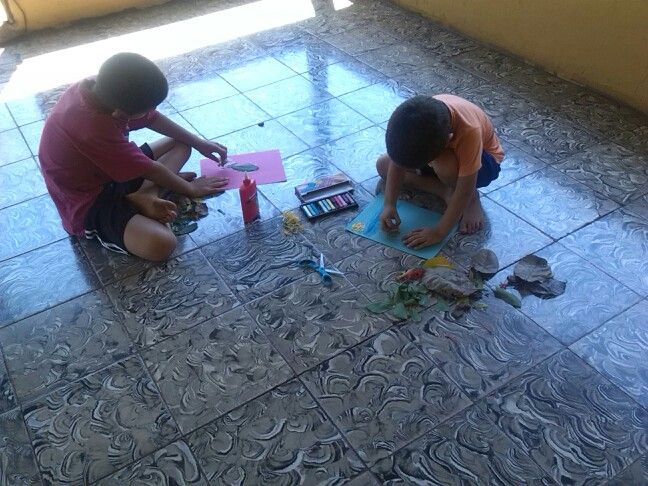
In order to click on black spaces between tiles in this screenshot , I will do `click(280, 382)`, `click(343, 347)`, `click(435, 364)`, `click(507, 378)`, `click(618, 314)`, `click(577, 150)`, `click(122, 467)`.